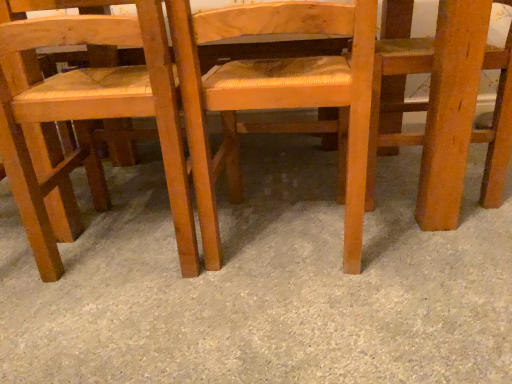
Question: From a real-world perspective, is gray carpet at center under wooden woven seat at left, the 3th chair in the right-to-left sequence?

Choices:
 (A) no
 (B) yes

Answer: (B)

Question: From the image's perspective, is gray carpet at center located above wooden woven seat at left, which ranks as the first chair in left-to-right order?

Choices:
 (A) yes
 (B) no

Answer: (B)

Question: Is gray carpet at center positioned beyond the bounds of wooden woven seat at left, the 3th chair in the right-to-left sequence?

Choices:
 (A) yes
 (B) no

Answer: (A)

Question: Is wooden woven seat at left, the 3th chair in the right-to-left sequence, inside gray carpet at center?

Choices:
 (A) yes
 (B) no

Answer: (B)

Question: Is gray carpet at center thinner than wooden woven seat at left, the 3th chair in the right-to-left sequence?

Choices:
 (A) no
 (B) yes

Answer: (A)

Question: From a real-world perspective, is wooden chair at right, the 1th chair positioned from the right, positioned above or below gray carpet at center?

Choices:
 (A) above
 (B) below

Answer: (A)

Question: Considering the positions of wooden chair at right, arranged as the 3th chair when viewed from the left, and gray carpet at center in the image, is wooden chair at right, arranged as the 3th chair when viewed from the left, bigger or smaller than gray carpet at center?

Choices:
 (A) small
 (B) big

Answer: (A)

Question: From their relative heights in the image, would you say wooden chair at right, arranged as the 3th chair when viewed from the left, is taller or shorter than gray carpet at center?

Choices:
 (A) tall
 (B) short

Answer: (A)

Question: Choose the correct answer: Is wooden chair at right, the 1th chair positioned from the right, inside gray carpet at center or outside it?

Choices:
 (A) inside
 (B) outside

Answer: (B)

Question: Visually, is wooden chair at center, which ranks as the 2th chair in left-to-right order, positioned to the left or to the right of gray carpet at center?

Choices:
 (A) left
 (B) right

Answer: (B)

Question: In terms of height, does wooden chair at center, which ranks as the 2th chair in left-to-right order, look taller or shorter compared to gray carpet at center?

Choices:
 (A) short
 (B) tall

Answer: (B)

Question: Is wooden chair at center, which ranks as the 2th chair in left-to-right order, inside the boundaries of gray carpet at center, or outside?

Choices:
 (A) outside
 (B) inside

Answer: (A)

Question: In the image, is wooden chair at center, which ranks as the 2th chair in left-to-right order, positioned in front of or behind gray carpet at center?

Choices:
 (A) front
 (B) behind

Answer: (B)

Question: Based on their positions, is wooden woven seat at left, which ranks as the first chair in left-to-right order, located to the left or right of wooden chair at right, arranged as the 3th chair when viewed from the left?

Choices:
 (A) left
 (B) right

Answer: (A)

Question: Is wooden woven seat at left, the 3th chair in the right-to-left sequence, bigger or smaller than wooden chair at right, arranged as the 3th chair when viewed from the left?

Choices:
 (A) small
 (B) big

Answer: (B)